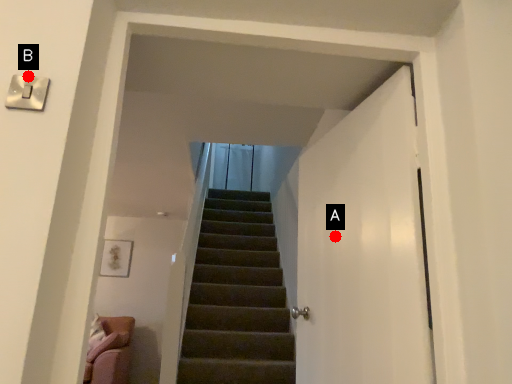
Question: Two points are circled on the image, labeled by A and B beside each circle. Which point appears closest to the camera in this image?

Choices:
 (A) A is closer
 (B) B is closer

Answer: (B)